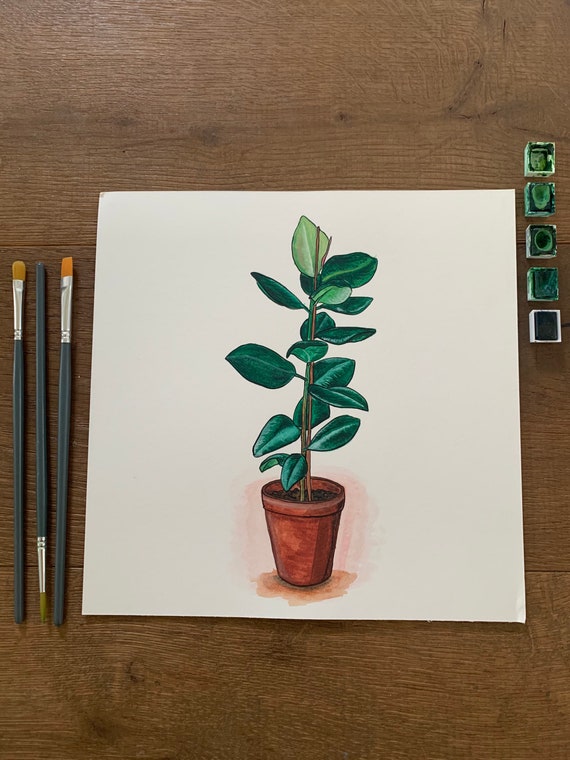
This screenshot has height=760, width=570. I want to click on green paint, so click(x=540, y=285).